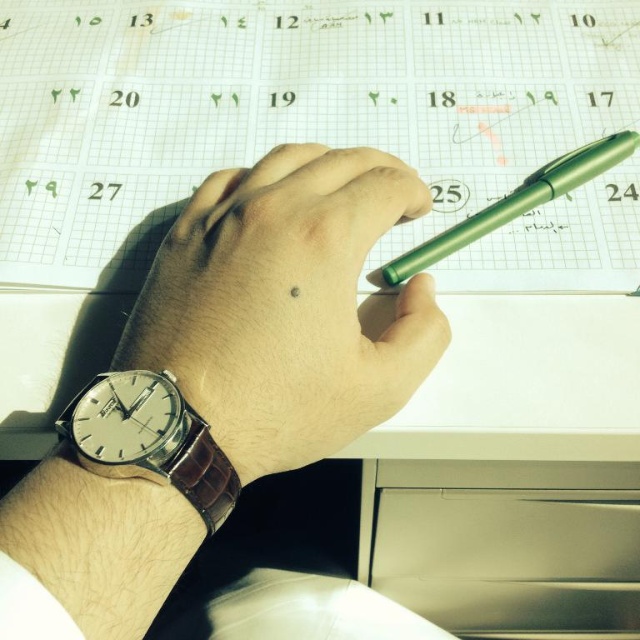
Question: Estimate the real-world distances between objects in this image. Which object is farther from the metallic silver drawer at lower right?

Choices:
 (A) sleek leather watch at center
 (B) silver leather watch at lower left

Answer: (B)

Question: Does sleek leather watch at center appear on the right side of metallic silver drawer at lower right?

Choices:
 (A) no
 (B) yes

Answer: (A)

Question: Can you confirm if silver leather watch at lower left is smaller than green metallic pen at upper right?

Choices:
 (A) yes
 (B) no

Answer: (A)

Question: Which object is the closest to the metallic silver drawer at lower right?

Choices:
 (A) silver leather watch at lower left
 (B) green metallic pen at upper right

Answer: (B)

Question: Which object appears farthest from the camera in this image?

Choices:
 (A) metallic silver drawer at lower right
 (B) green metallic pen at upper right

Answer: (A)

Question: Can you confirm if sleek leather watch at center is positioned above silver leather watch at lower left?

Choices:
 (A) yes
 (B) no

Answer: (A)